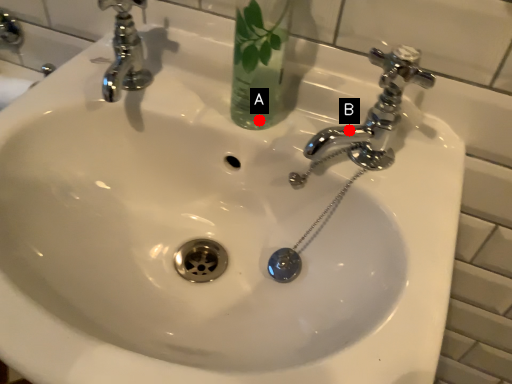
Question: Two points are circled on the image, labeled by A and B beside each circle. Which point is farther from the camera taking this photo?

Choices:
 (A) A is further
 (B) B is further

Answer: (A)